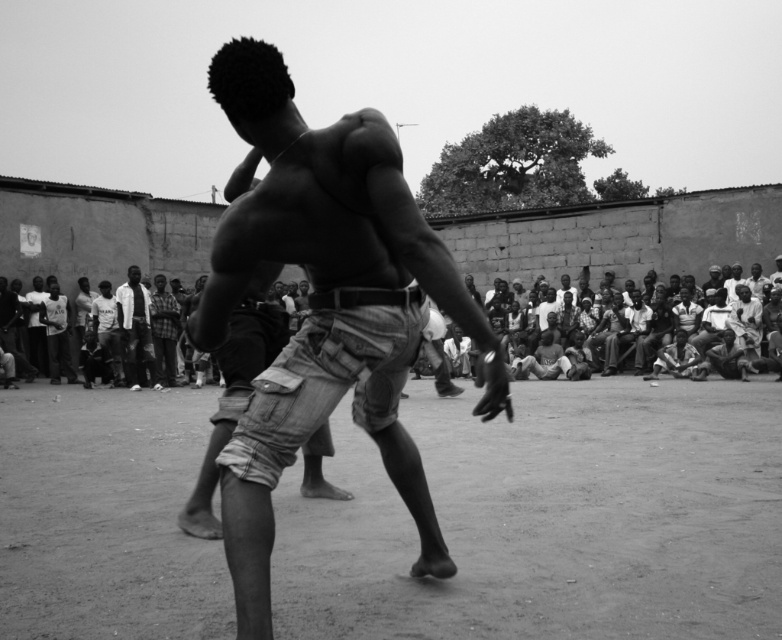
Consider the image. Does dirt field at center appear on the right side of denim shorts at center?

No, dirt field at center is not to the right of denim shorts at center.

Does dirt field at center appear under denim shorts at center?

Correct, dirt field at center is located below denim shorts at center.

Who is more distant from viewer, (485, 554) or (490, 358)?

The point (485, 554) is more distant.

Locate an element on the screen. dirt field at center is located at coordinates (551, 518).

This screenshot has height=640, width=782. In order to click on dirt field at center in this screenshot , I will do `click(551, 518)`.

Which is behind, point (526, 404) or point (131, 284)?

The point (131, 284) is behind.

Find the location of a particular element. The width and height of the screenshot is (782, 640). dirt field at center is located at coordinates (551, 518).

Is light gray cotton shirt at center smaller than checkered fabric shirt at center?

Incorrect, light gray cotton shirt at center is not smaller in size than checkered fabric shirt at center.

Is light gray cotton shirt at center above checkered fabric shirt at center?

Indeed, light gray cotton shirt at center is positioned over checkered fabric shirt at center.

Who is more distant from viewer, (131, 289) or (156, 323)?

Positioned behind is point (156, 323).

You are a GUI agent. You are given a task and a screenshot of the screen. Output one action in this format:
    pyautogui.click(x=<x>, y=<y>)
    Task: Click on the light gray cotton shirt at center
    
    Given the screenshot: What is the action you would take?
    pyautogui.click(x=135, y=330)